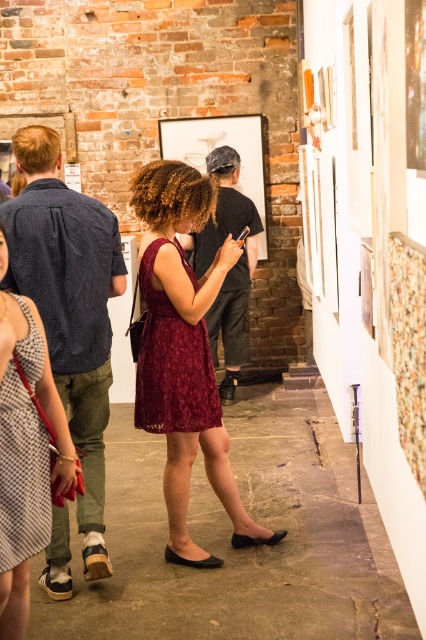
You are standing in the art gallery and want to take a photo of the point at coordinates point (198, 280). If your camera has a maximum focus range of 4 meters, will you be able to capture it clearly?

The point (198, 280) is 4.34 meters away from you, which exceeds the camera maximum focus range of 4 meters. So you won not be able to capture it clearly.

You are an interior designer planning to place a new sculpture in the art gallery. The sculpture requires a clear space of 1 meter in front of it. Considering the burgundy lace dress at center is currently at point 0.553, 0.432, is there enough space to place the sculpture there?

The burgundy lace dress at center is located at point (184, 353), so there is enough space to place the sculpture there as the coordinates indicate sufficient clearance for the required 1 meter.

You are an artist observing two dresses displayed at the center of the gallery. The dresses are labeled as the burgundy lace dress at center and the checkered fabric dress at center. Which dress is covering part of the other one?

The burgundy lace dress at center is positioned over the checkered fabric dress at center, so it is covering part of the checkered fabric dress at center.